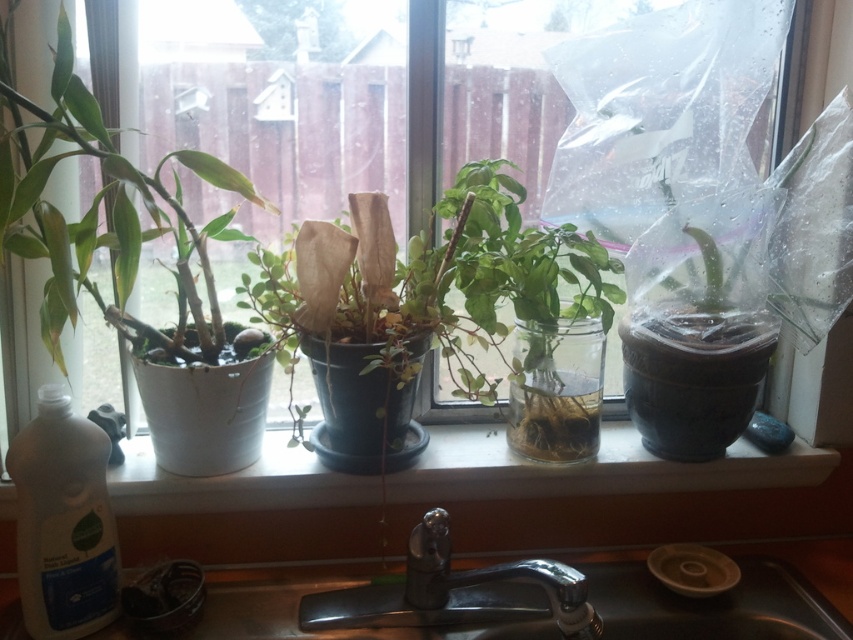
You are arranging plants on the windowsill and want to place the green matte plant at center to the right of the white glossy window sill at center. Is this possible given their current positions?

The green matte plant at center is currently positioned on the left side of the white glossy window sill at center. To move it to the right side would require rearranging them, so it is not possible in their current positions.

You are a gardener who needs to water the plants. You are standing in front of the windowsill and see the green matte plant at center and the metallic sink at lower center. Which object is closer to you?

The green matte plant at center is closer to you because it is further to the viewer than the metallic sink at lower center.